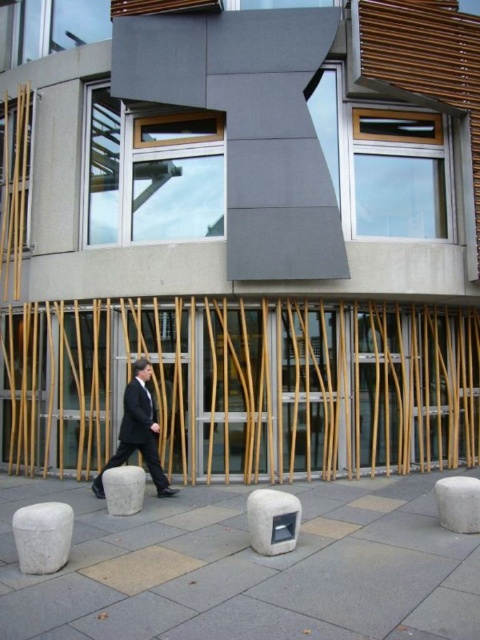
Question: Considering the relative positions of white stone stool at lower left and white stone stool at lower center in the image provided, where is white stone stool at lower left located with respect to white stone stool at lower center?

Choices:
 (A) above
 (B) below

Answer: (A)

Question: Can you confirm if white stone speaker at center is wider than white stone stool at lower center?

Choices:
 (A) yes
 (B) no

Answer: (A)

Question: Which object is the farthest from the dark gray matte suit at center?

Choices:
 (A) white stone stool at lower right
 (B) gray concrete stool at lower center
 (C) white stone stool at lower center

Answer: (A)

Question: Which point is closer to the camera?

Choices:
 (A) (149, 401)
 (B) (149, 438)
 (C) (69, 538)

Answer: (C)

Question: Can you confirm if white stone stool at lower left is bigger than gray concrete stool at lower center?

Choices:
 (A) yes
 (B) no

Answer: (B)

Question: Which of the following is the closest to the observer?

Choices:
 (A) white stone stool at lower right
 (B) gray concrete stool at lower center
 (C) white stone speaker at center

Answer: (C)